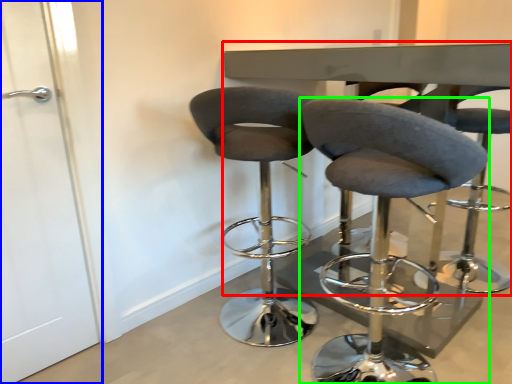
Question: Which object is the closest to the round table (highlighted by a red box)? Choose among these: screen door (highlighted by a blue box) or chair (highlighted by a green box).

Choices:
 (A) screen door
 (B) chair

Answer: (B)